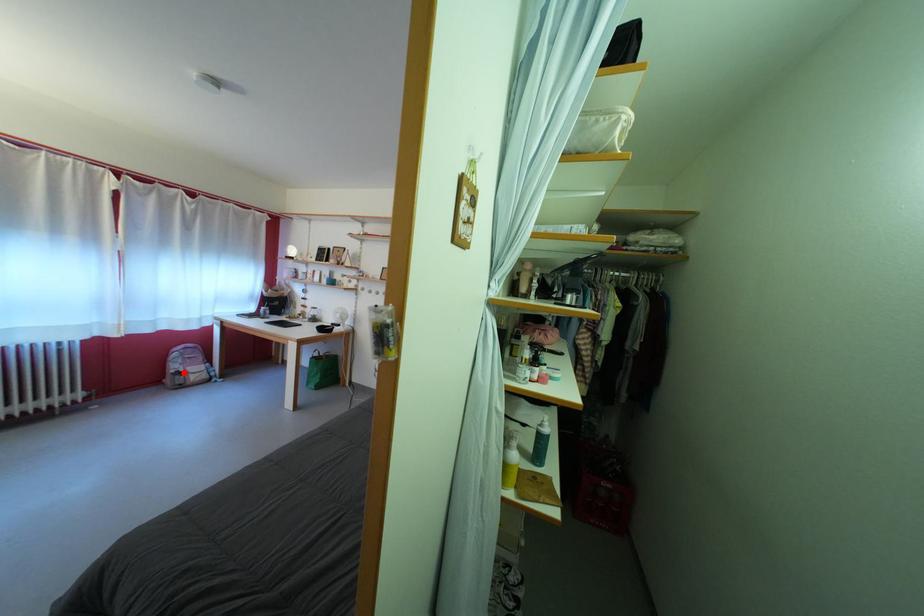
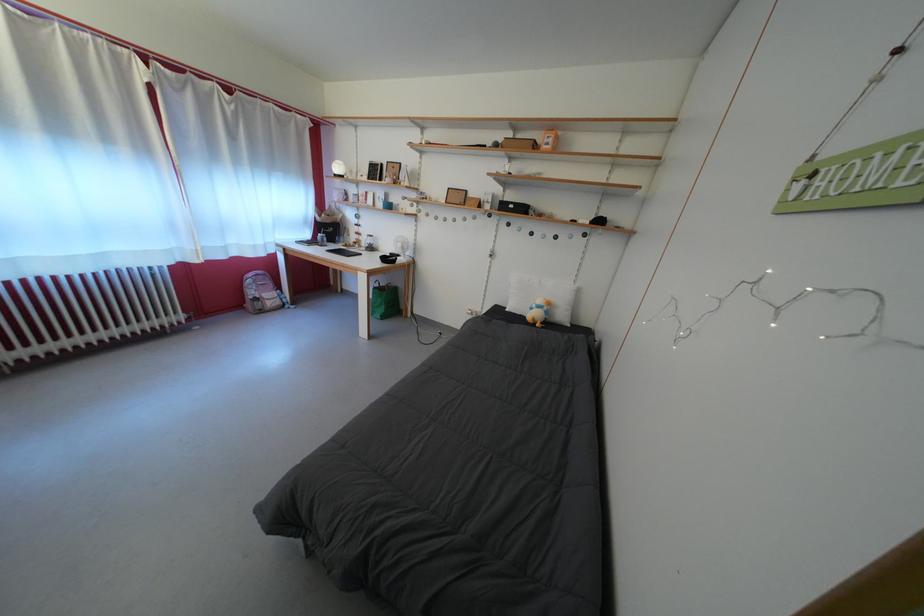
The point at the highlighted location is marked in the first image. Where is the corresponding point in the second image?

(261, 299)